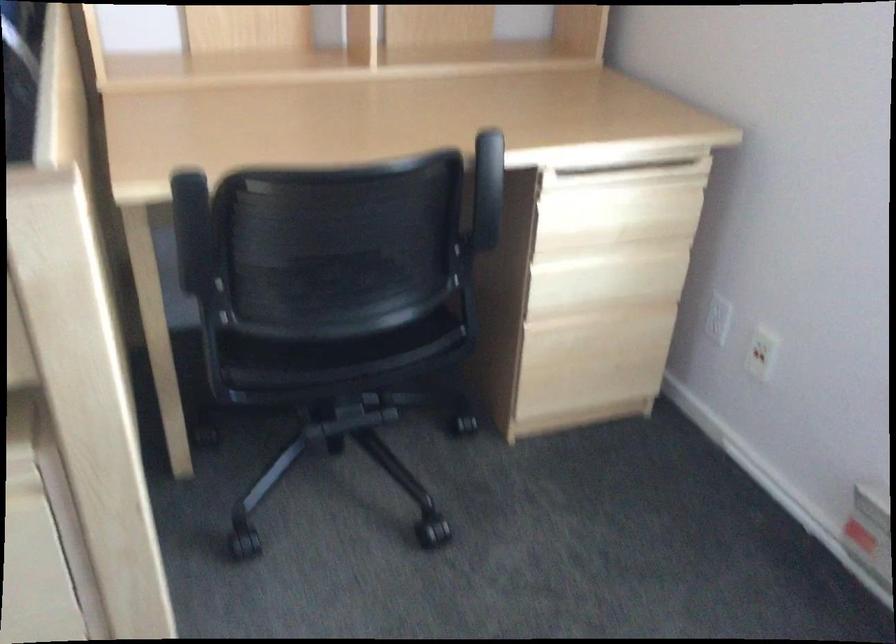
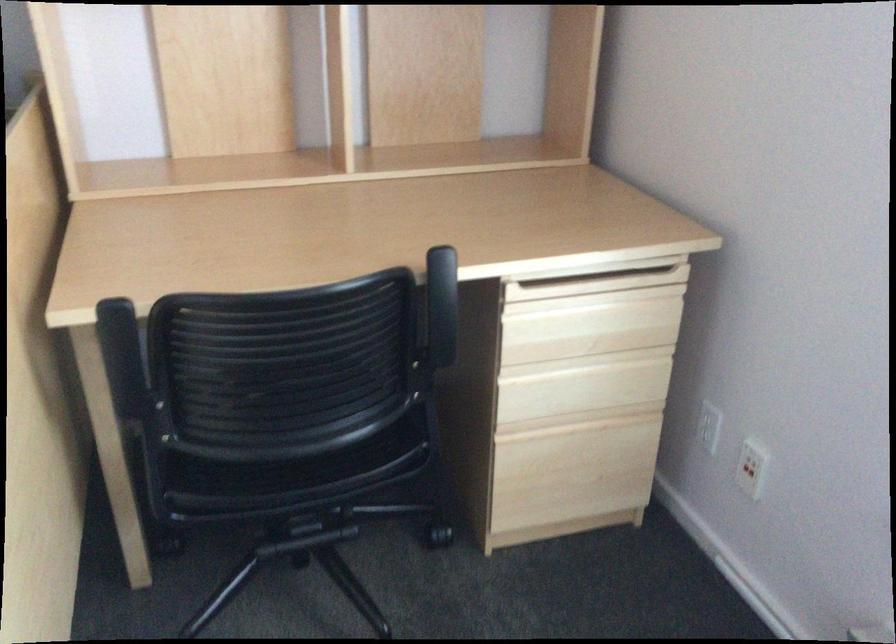
Find the pixel in the second image that matches pixel 756 355 in the first image.

(747, 469)